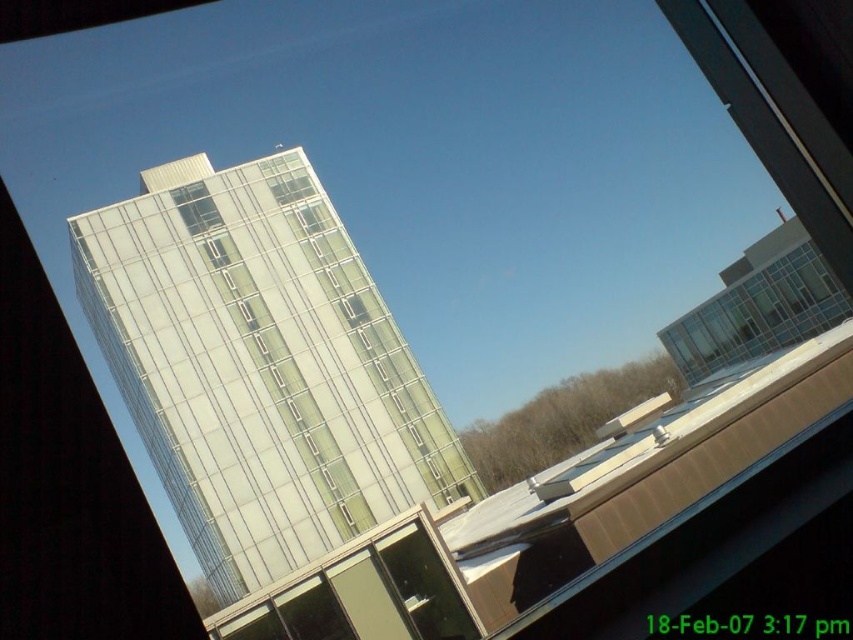
You are an architect designing a new building and want to compare the sizes of the windows in the existing structure. Looking at the image, which window is larger between the transparent glass window at upper right and the clear glass window at upper center?

The transparent glass window at upper right is bigger than the clear glass window at upper center according to the description.

You are an architect analyzing the building design. You need to determine if the clear glass building at center can be entirely seen through the clear glass window at upper center. Based on their widths, what is your conclusion?

The clear glass building at center is wider than the clear glass window at upper center, so it cannot be entirely seen through the clear glass window at upper center.

You are standing in a room looking through the window. There are two points marked on the window glass at coordinates point (775,264) and point (283,188). Which point is closer to your eyes?

Point (283,188) is closer to your eyes because it is less further to the camera than point (775,264).